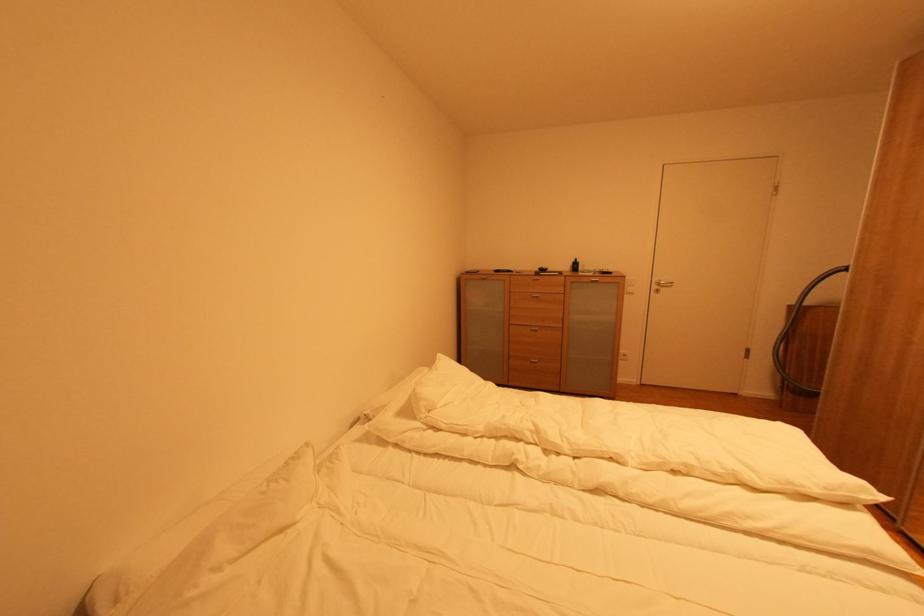
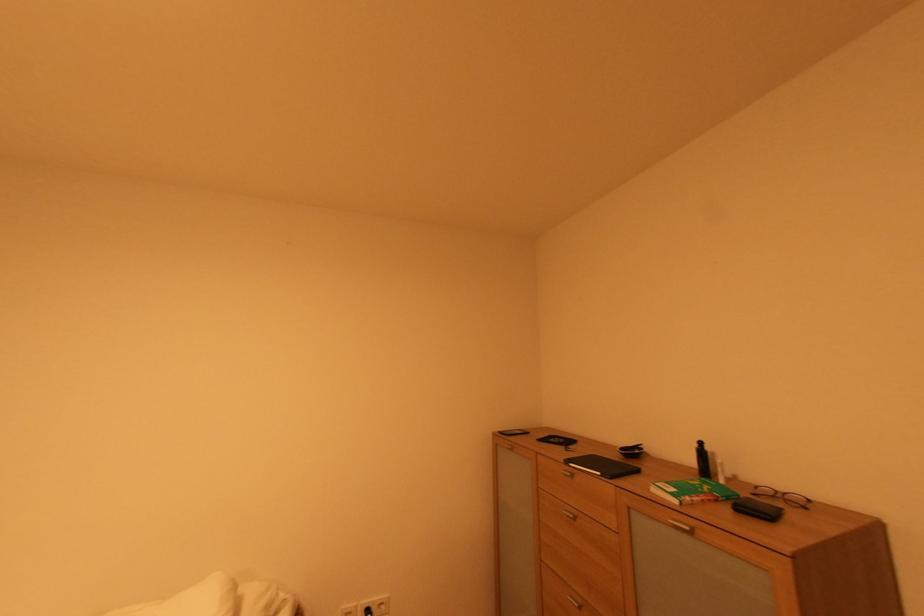
In the second image, find the point that corresponds to pixel 597 275 in the first image.

(682, 503)